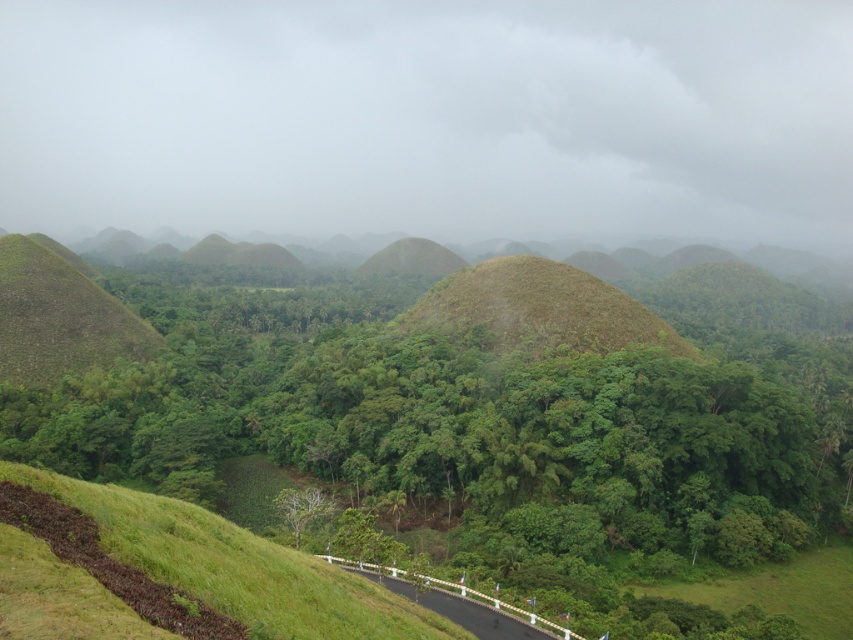
From the picture: Is green grassy hill at center smaller than black asphalt road at lower center?

No, green grassy hill at center is not smaller than black asphalt road at lower center.

The height and width of the screenshot is (640, 853). What do you see at coordinates (480, 432) in the screenshot?
I see `green grassy hill at center` at bounding box center [480, 432].

Is point (74, 410) more distant than point (405, 595)?

Yes, it is.

Where is `green grassy hill at center`? green grassy hill at center is located at coordinates (480, 432).

Is point (485, 310) farther from camera compared to point (299, 490)?

Yes, point (485, 310) is farther from viewer.

Locate an element on the screen. The height and width of the screenshot is (640, 853). brown grassy hill at center is located at coordinates (538, 308).

Can you confirm if green grassy hill at center is bigger than brown grassy hill at center?

Correct, green grassy hill at center is larger in size than brown grassy hill at center.

Is green grassy hill at center to the left of brown grassy hill at center from the viewer's perspective?

Correct, you'll find green grassy hill at center to the left of brown grassy hill at center.

Is point (598, 394) positioned behind point (573, 348)?

No.

Find the location of a particular element. Image resolution: width=853 pixels, height=640 pixels. green grassy hill at center is located at coordinates (480, 432).